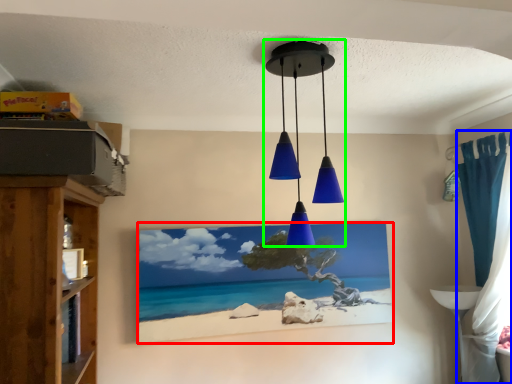
Question: Based on their relative distances, which object is farther from picture frame (highlighted by a red box)? Choose from curtain (highlighted by a blue box) and lamp (highlighted by a green box).

Choices:
 (A) curtain
 (B) lamp

Answer: (A)